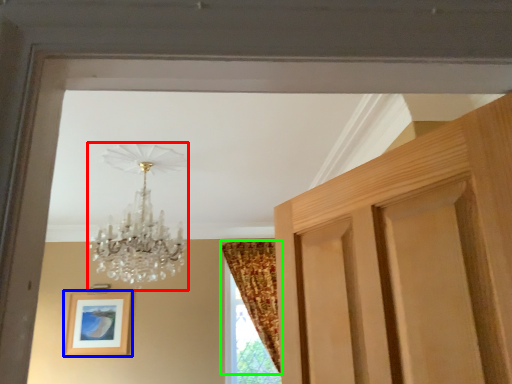
Question: Which is nearer to the lamp (highlighted by a red box)? picture frame (highlighted by a blue box) or curtain (highlighted by a green box).

Choices:
 (A) picture frame
 (B) curtain

Answer: (B)